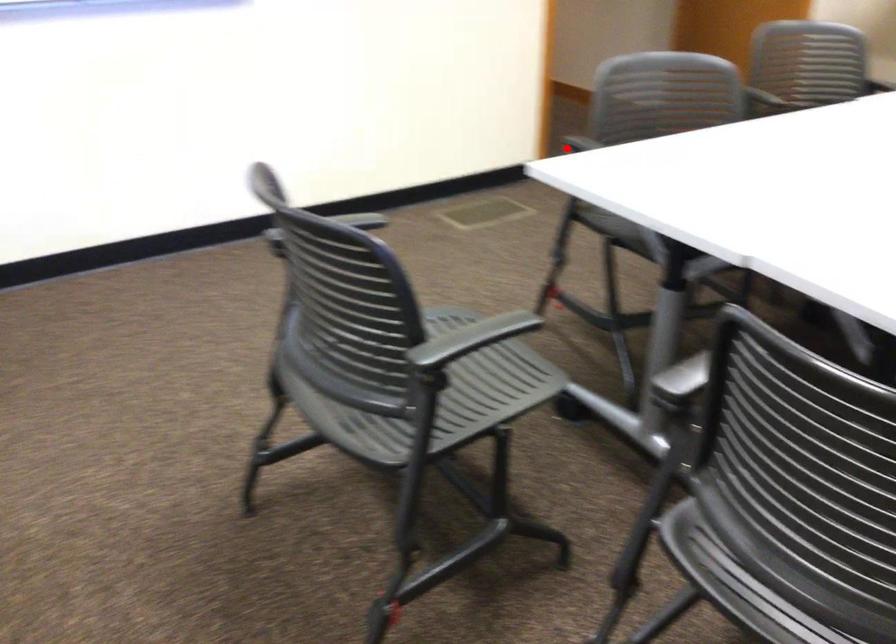
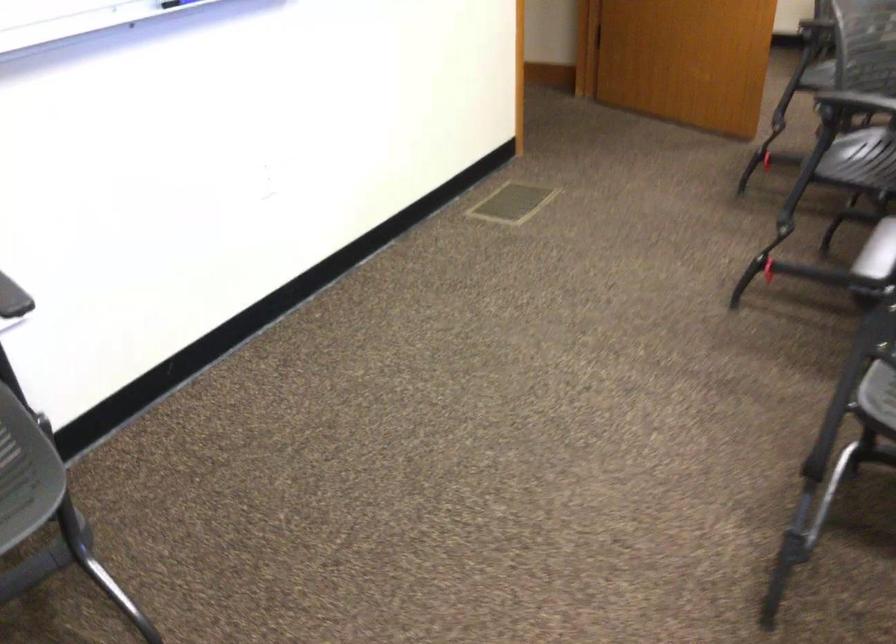
Question: I am providing you with two images of the same scene from different viewpoints. Given a red point in image1, look at the same physical point in image2. Is it:

Choices:
 (A) Closer to the viewpoint
 (B) Farther from the viewpoint

Answer: (A)